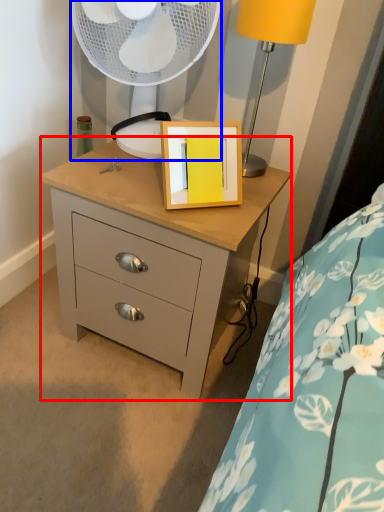
Question: Which of the following is the farthest to the observer, chest of drawers (highlighted by a red box) or mechanical fan (highlighted by a blue box)?

Choices:
 (A) chest of drawers
 (B) mechanical fan

Answer: (B)